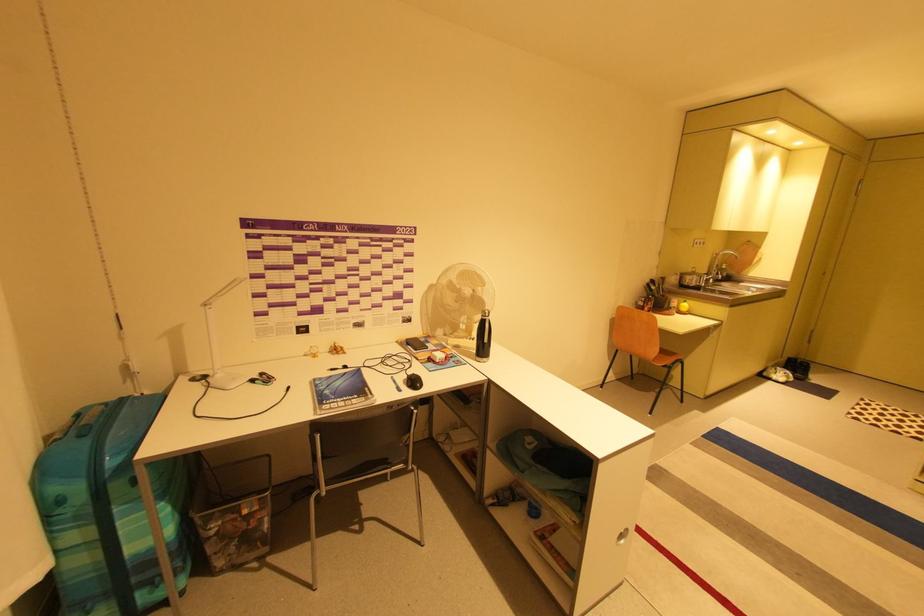
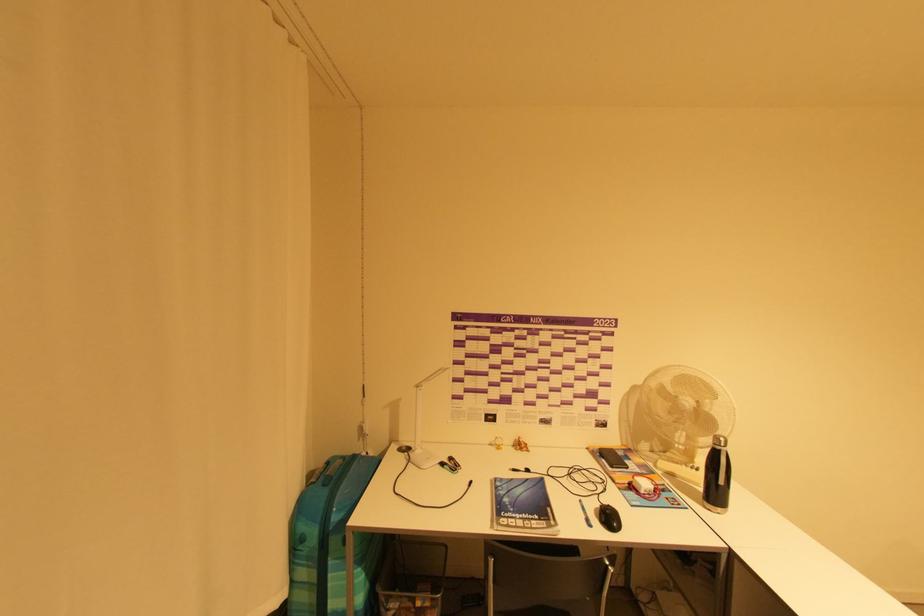
The point at (336, 377) is marked in the first image. Where is the corresponding point in the second image?

(517, 480)